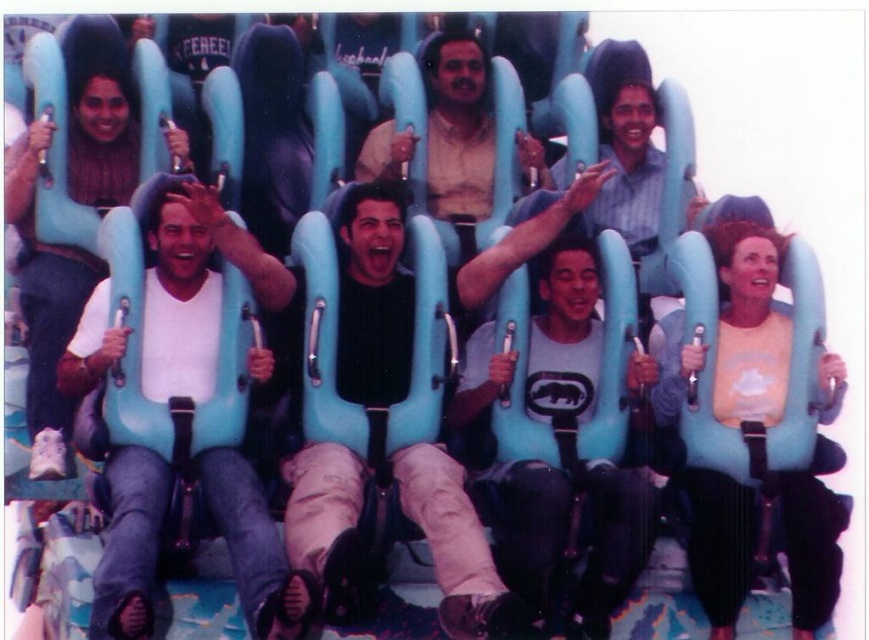
Measure the distance between point (100, 356) and camera.

Point (100, 356) is 67.86 meters from camera.

Between point (151, 237) and point (555, 326), which one is positioned in front?

Point (151, 237)

Where is `white matte t-shirt at center`? white matte t-shirt at center is located at coordinates (196, 288).

Who is more distant from viewer, (124,545) or (47,372)?

The point (47,372) is more distant.

Does white matte t-shirt at center have a lesser width compared to white matte t-shirt at left?

No.

What do you see at coordinates (196, 288) in the screenshot?
I see `white matte t-shirt at center` at bounding box center [196, 288].

This screenshot has width=869, height=640. I want to click on white matte t-shirt at center, so click(196, 288).

Who is positioned more to the left, white matte t-shirt at center or matte beige shirt at center?

From the viewer's perspective, white matte t-shirt at center appears more on the left side.

Measure the distance between white matte t-shirt at center and camera.

The distance of white matte t-shirt at center from camera is 59.39 meters.

The width and height of the screenshot is (869, 640). I want to click on white matte t-shirt at center, so click(x=196, y=288).